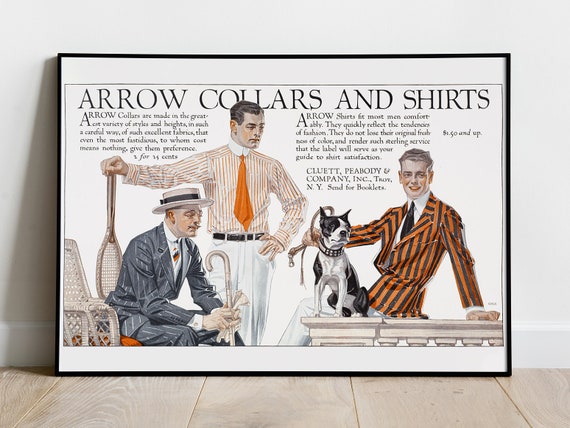
The width and height of the screenshot is (570, 428). In order to click on wall in this screenshot , I will do `click(36, 249)`.